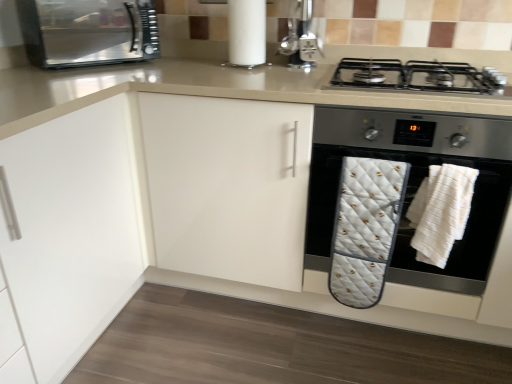
What do you see at coordinates (247, 32) in the screenshot? I see `white matte paper towel at upper center` at bounding box center [247, 32].

Locate an element on the screen. This screenshot has height=384, width=512. metallic silver coffee machine at upper center is located at coordinates (301, 37).

What do you see at coordinates (418, 76) in the screenshot? I see `black matte gas stove at upper right` at bounding box center [418, 76].

What do you see at coordinates (88, 32) in the screenshot? I see `metallic stainless steel microwave at upper left` at bounding box center [88, 32].

The height and width of the screenshot is (384, 512). What do you see at coordinates (365, 228) in the screenshot?
I see `white quilted oven mitt at center, which ranks as the second bath towel in right-to-left order` at bounding box center [365, 228].

The width and height of the screenshot is (512, 384). Describe the element at coordinates (441, 212) in the screenshot. I see `white textured bath towel at lower right, which is counted as the first bath towel, starting from the right` at that location.

Image resolution: width=512 pixels, height=384 pixels. Identify the location of white matte paper towel at upper center. (247, 32).

From the picture: Between white textured bath towel at lower right, which is counted as the first bath towel, starting from the right, and white matte paper towel at upper center, which one has smaller size?

white matte paper towel at upper center is smaller.

Do you think white textured bath towel at lower right, which is counted as the first bath towel, starting from the right, is within white matte paper towel at upper center, or outside of it?

white textured bath towel at lower right, which is counted as the first bath towel, starting from the right, is located beyond the bounds of white matte paper towel at upper center.

In the image, is white textured bath towel at lower right, the 2th bath towel from the left, positioned in front of or behind white matte paper towel at upper center?

white textured bath towel at lower right, the 2th bath towel from the left, is in front of white matte paper towel at upper center.

Measure the distance between metallic silver coffee machine at upper center and white textured bath towel at lower right, the 2th bath towel from the left.

They are 78.71 centimeters apart.

Relative to white textured bath towel at lower right, which is counted as the first bath towel, starting from the right, is metallic silver coffee machine at upper center in front or behind?

metallic silver coffee machine at upper center is positioned farther from the viewer than white textured bath towel at lower right, which is counted as the first bath towel, starting from the right.

From the image's perspective, relative to white textured bath towel at lower right, the 2th bath towel from the left, is metallic silver coffee machine at upper center above or below?

From the image's perspective, metallic silver coffee machine at upper center appears above white textured bath towel at lower right, the 2th bath towel from the left.

Do you think metallic silver coffee machine at upper center is within white textured bath towel at lower right, the 2th bath towel from the left, or outside of it?

metallic silver coffee machine at upper center cannot be found inside white textured bath towel at lower right, the 2th bath towel from the left.

From the picture: Which object is more forward, white quilted oven mitt at lower right or white quilted oven mitt at center, which ranks as the second bath towel in right-to-left order?

white quilted oven mitt at lower right is closer to the camera.

Is white quilted oven mitt at lower right at the right side of white quilted oven mitt at center, which is the first bath towel from left to right?

A: Correct, you'll find white quilted oven mitt at lower right to the right of white quilted oven mitt at center, which is the first bath towel from left to right.

Is white quilted oven mitt at lower right wider or thinner than white quilted oven mitt at center, which ranks as the second bath towel in right-to-left order?

white quilted oven mitt at lower right is wider than white quilted oven mitt at center, which ranks as the second bath towel in right-to-left order.

Considering the sizes of objects white quilted oven mitt at lower right and white quilted oven mitt at center, which is the first bath towel from left to right, in the image provided, who is taller, white quilted oven mitt at lower right or white quilted oven mitt at center, which is the first bath towel from left to right,?

Standing taller between the two is white quilted oven mitt at lower right.

Who is bigger, metallic stainless steel microwave at upper left or white quilted oven mitt at lower right?

With larger size is white quilted oven mitt at lower right.

Consider the image. Is metallic stainless steel microwave at upper left in contact with white quilted oven mitt at lower right?

No, metallic stainless steel microwave at upper left is not touching white quilted oven mitt at lower right.

Can you tell me how much metallic stainless steel microwave at upper left and white quilted oven mitt at lower right differ in facing direction?

49.9 degrees separate the facing orientations of metallic stainless steel microwave at upper left and white quilted oven mitt at lower right.

Which of these two, metallic stainless steel microwave at upper left or white quilted oven mitt at lower right, stands shorter?

Standing shorter between the two is metallic stainless steel microwave at upper left.

Considering the sizes of objects white textured bath towel at lower right, which is counted as the first bath towel, starting from the right, and metallic stainless steel microwave at upper left in the image provided, who is smaller, white textured bath towel at lower right, which is counted as the first bath towel, starting from the right, or metallic stainless steel microwave at upper left?

Smaller between the two is white textured bath towel at lower right, which is counted as the first bath towel, starting from the right.

From the image's perspective, between white textured bath towel at lower right, the 2th bath towel from the left, and metallic stainless steel microwave at upper left, which one is located above?

metallic stainless steel microwave at upper left is shown above in the image.

Is white textured bath towel at lower right, which is counted as the first bath towel, starting from the right, outside of metallic stainless steel microwave at upper left?

Indeed, white textured bath towel at lower right, which is counted as the first bath towel, starting from the right, is completely outside metallic stainless steel microwave at upper left.

Are white textured bath towel at lower right, the 2th bath towel from the left, and metallic stainless steel microwave at upper left far apart?

Indeed, white textured bath towel at lower right, the 2th bath towel from the left, is not near metallic stainless steel microwave at upper left.

Is metallic stainless steel microwave at upper left located outside black matte gas stove at upper right?

Absolutely, metallic stainless steel microwave at upper left is external to black matte gas stove at upper right.

Are metallic stainless steel microwave at upper left and black matte gas stove at upper right making contact?

No.

How many degrees apart are the facing directions of metallic stainless steel microwave at upper left and black matte gas stove at upper right?

metallic stainless steel microwave at upper left and black matte gas stove at upper right are facing 50.2 degrees away from each other.

In the image, is metallic stainless steel microwave at upper left positioned in front of or behind black matte gas stove at upper right?

metallic stainless steel microwave at upper left is behind black matte gas stove at upper right.

Is white matte paper towel at upper center facing away from white quilted oven mitt at lower right?

No, white matte paper towel at upper center's orientation is not away from white quilted oven mitt at lower right.

Who is shorter, white matte paper towel at upper center or white quilted oven mitt at lower right?

white matte paper towel at upper center.

In the scene shown: Which of these two, white matte paper towel at upper center or white quilted oven mitt at lower right, is wider?

Wider between the two is white quilted oven mitt at lower right.

The height and width of the screenshot is (384, 512). Find the location of `home appliance below the white matte paper towel at upper center (from the image's perspective)`. home appliance below the white matte paper towel at upper center (from the image's perspective) is located at coordinates (414, 185).

Where is `the 2nd bath towel in front when counting from the white matte paper towel at upper center`? the 2nd bath towel in front when counting from the white matte paper towel at upper center is located at coordinates (441, 212).

Identify the location of the 1st bath towel below the metallic silver coffee machine at upper center (from the image's perspective). The width and height of the screenshot is (512, 384). [441, 212].

Looking at this image, estimate the real-world distances between objects in this image. Which object is further from black matte gas stove at upper right, white matte paper towel at upper center or metallic silver coffee machine at upper center?

white matte paper towel at upper center lies further to black matte gas stove at upper right than the other object.

Estimate the real-world distances between objects in this image. Which object is further from white quilted oven mitt at center, which is the first bath towel from left to right, metallic silver coffee machine at upper center or metallic stainless steel microwave at upper left?

Among the two, metallic stainless steel microwave at upper left is located further to white quilted oven mitt at center, which is the first bath towel from left to right.

Considering their positions, is white textured bath towel at lower right, which is counted as the first bath towel, starting from the right, positioned closer to white quilted oven mitt at center, which ranks as the second bath towel in right-to-left order, than white quilted oven mitt at lower right?

white quilted oven mitt at lower right is positioned closer to the anchor white quilted oven mitt at center, which ranks as the second bath towel in right-to-left order.

Looking at the image, which one is located further to white quilted oven mitt at center, which ranks as the second bath towel in right-to-left order, metallic silver coffee machine at upper center or white textured bath towel at lower right, the 2th bath towel from the left?

metallic silver coffee machine at upper center lies further to white quilted oven mitt at center, which ranks as the second bath towel in right-to-left order, than the other object.

From the image, which object appears to be nearer to black matte gas stove at upper right, white quilted oven mitt at lower right or white textured bath towel at lower right, the 2th bath towel from the left?

Among the two, white quilted oven mitt at lower right is located nearer to black matte gas stove at upper right.

Which object lies further to the anchor point white textured bath towel at lower right, which is counted as the first bath towel, starting from the right, black matte gas stove at upper right or white matte paper towel at upper center?

Among the two, white matte paper towel at upper center is located further to white textured bath towel at lower right, which is counted as the first bath towel, starting from the right.

Based on their spatial positions, is white matte paper towel at upper center or black matte gas stove at upper right further from white quilted oven mitt at center, which is the first bath towel from left to right?

Among the two, white matte paper towel at upper center is located further to white quilted oven mitt at center, which is the first bath towel from left to right.

From the picture: From the image, which object appears to be nearer to white textured bath towel at lower right, the 2th bath towel from the left, white quilted oven mitt at lower right or white matte paper towel at upper center?

white quilted oven mitt at lower right lies closer to white textured bath towel at lower right, the 2th bath towel from the left, than the other object.

Identify the location of home appliance between metallic silver coffee machine at upper center and white quilted oven mitt at center, which is the first bath towel from left to right, in the up-down direction. The image size is (512, 384). (414, 185).

At what (x,y) coordinates should I click in order to perform the action: click on paper towel between metallic silver coffee machine at upper center and white quilted oven mitt at center, which is the first bath towel from left to right, in the vertical direction. Please return your answer as a coordinate pair (x, y). This screenshot has width=512, height=384. Looking at the image, I should click on (247, 32).

Where is `home appliance between black matte gas stove at upper right and white quilted oven mitt at center, which is the first bath towel from left to right, in the up-down direction`? home appliance between black matte gas stove at upper right and white quilted oven mitt at center, which is the first bath towel from left to right, in the up-down direction is located at coordinates (414, 185).

Locate an element on the screen. Image resolution: width=512 pixels, height=384 pixels. gas stove between metallic silver coffee machine at upper center and white quilted oven mitt at center, which ranks as the second bath towel in right-to-left order, in the up-down direction is located at coordinates (418, 76).